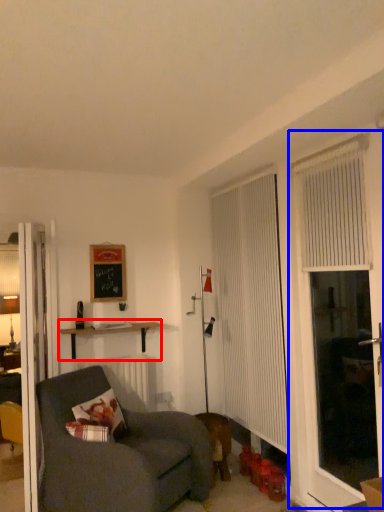
Question: Which point is further to the camera, shelf (highlighted by a red box) or screen door (highlighted by a blue box)?

Choices:
 (A) shelf
 (B) screen door

Answer: (A)